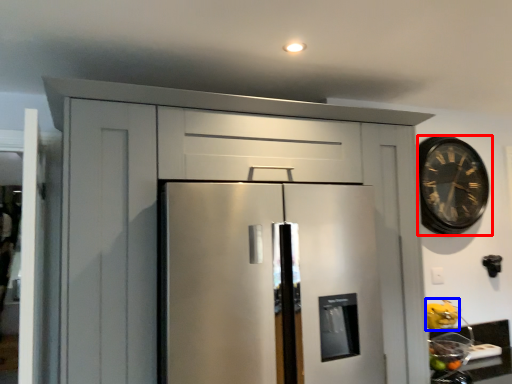
Question: Which of the following is the closest to the observer, clock (highlighted by a red box) or fruit (highlighted by a blue box)?

Choices:
 (A) clock
 (B) fruit

Answer: (B)